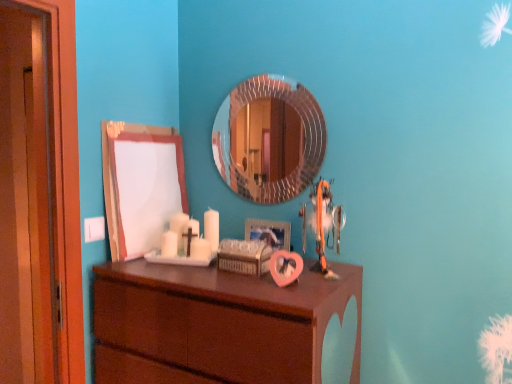
Locate an element on the screen. free point above brown wood chest of drawers at center (from a real-world perspective) is located at coordinates (224, 269).